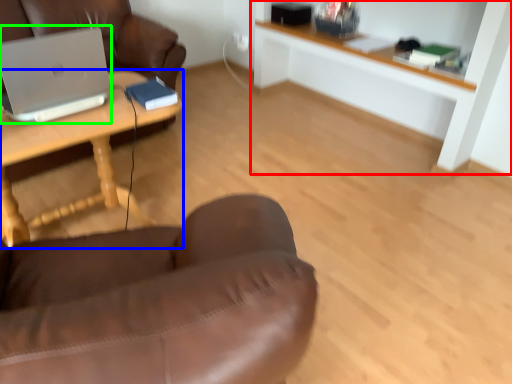
Question: Which is farther away from shelf (highlighted by a red box)? desk (highlighted by a blue box) or laptop (highlighted by a green box)?

Choices:
 (A) desk
 (B) laptop

Answer: (B)